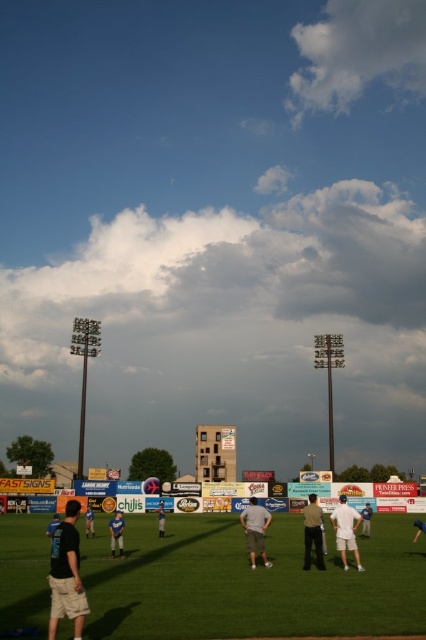
You are standing on the baseball field and want to move from the point at coordinates point (256, 509) to the point at coordinates point (317, 525). Which direction should you move to get closer to the latter point?

You should move towards the direction away from the camera because point (256, 509) is further to the camera than point (317, 525).

You are a photographer standing at the edge of the baseball field. You want to take a photo that includes both the green grass field at center and the light blue jersey at center. Which object will appear larger in your photo?

The green grass field at center will appear larger in the photo because it is closer to the viewer than the light blue jersey at center.

You are standing at the point with coordinates (250, 582) on the baseball field. What is the terrain like under your feet?

The point at (250, 582) corresponds to the green grass field at center, so the terrain under your feet is green grass.